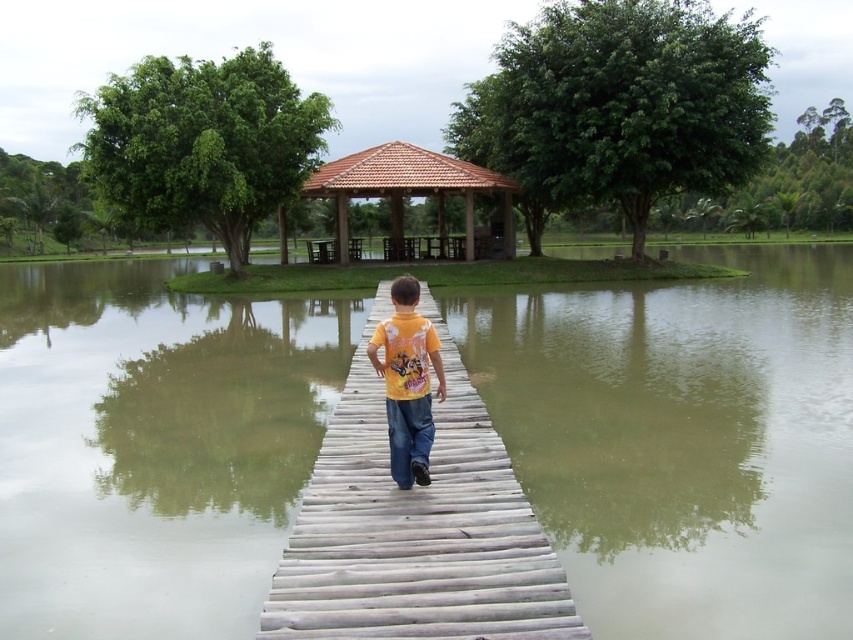
You are standing at the end of the wooden pier and see the point marked at coordinates [415,529]. What object is located at that point?

The point at coordinates [415,529] corresponds to the wooden bridge at center.